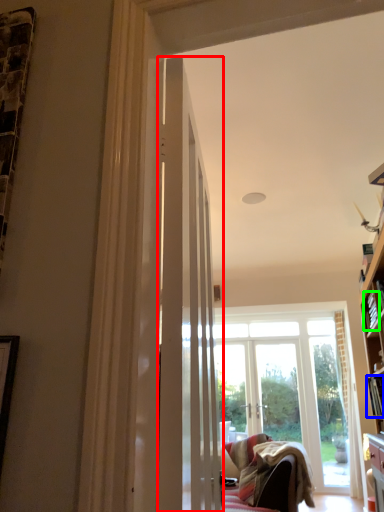
Question: Which is nearer to the door (highlighted by a red box)? book (highlighted by a blue box) or book (highlighted by a green box).

Choices:
 (A) book
 (B) book

Answer: (B)